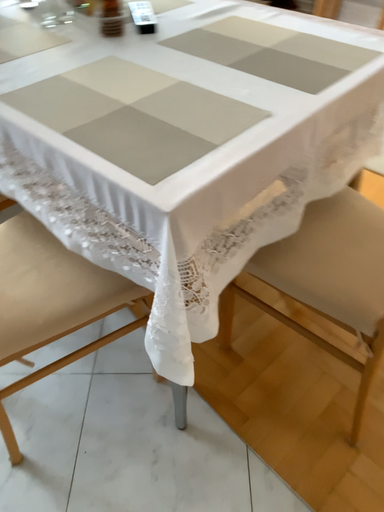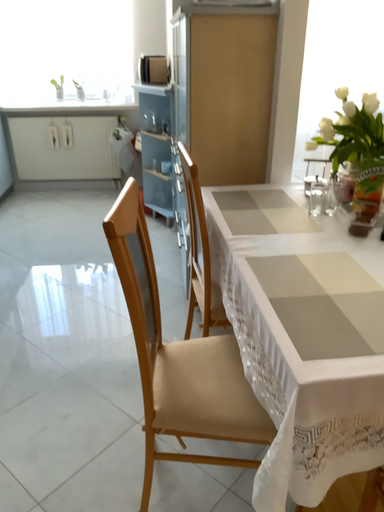
Question: Which way did the camera rotate in the video?

Choices:
 (A) rotated downward
 (B) rotated upward

Answer: (B)